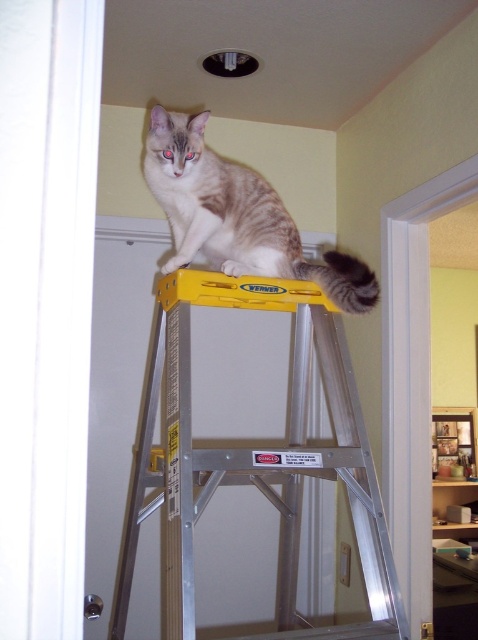
You are a painter who needs to reach the ceiling fixture. You see the yellow metallic ladder at upper center and the tabby fur cat at center. Which object is closer to you, the painter, so you can safely climb it?

The yellow metallic ladder at upper center is in front of the tabby fur cat at center, so it is closer to you and safe to climb.

You are a painter needing to reach a high ceiling. You see a yellow metallic ladder at upper center and a tabby fur cat at center. Which object is bigger and can provide better support for climbing?

The yellow metallic ladder at upper center is larger and can provide better support for climbing compared to the tabby fur cat at center.